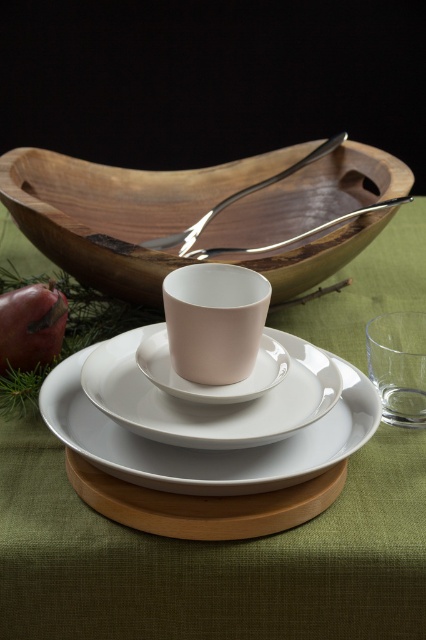
Question: Which point is closer to the camera?

Choices:
 (A) (357, 268)
 (B) (201, 220)
 (C) (172, 353)

Answer: (C)

Question: Estimate the real-world distances between objects in this image. Which object is farther from the wooden bowl at upper center?

Choices:
 (A) matte ceramic cup at center
 (B) silver metallic spoon at upper center
 (C) white ceramic saucer at center
 (D) polished metal spoon at upper center

Answer: (C)

Question: From the image, what is the correct spatial relationship of matte ceramic cup at center in relation to white ceramic saucer at center?

Choices:
 (A) above
 (B) below

Answer: (A)

Question: Does polished metal spoon at upper center have a lesser width compared to silver metallic spoon at upper center?

Choices:
 (A) yes
 (B) no

Answer: (B)

Question: Which object appears closest to the camera in this image?

Choices:
 (A) white matte plate at center
 (B) white glossy platter at center
 (C) matte ceramic cup at center
 (D) polished metal spoon at upper center

Answer: (A)

Question: From the image, what is the correct spatial relationship of white matte plate at center in relation to wooden bowl at upper center?

Choices:
 (A) left
 (B) right

Answer: (A)